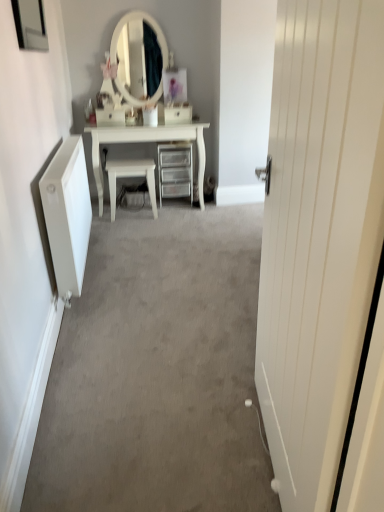
Locate an element on the screen. vacant space situated above white plastic drawer at center, acting as the second drawer starting from the left (from a real-world perspective) is located at coordinates (175, 106).